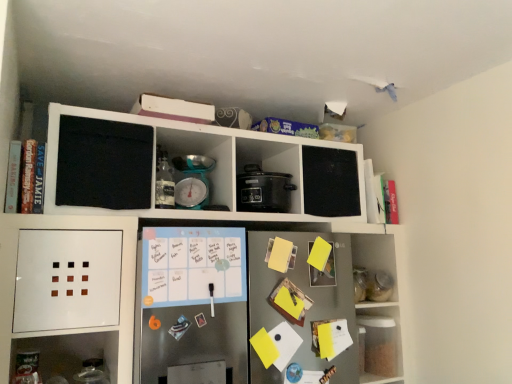
Locate an element on the screen. This screenshot has height=384, width=512. teal plastic scale at center, which is counted as the 1th appliance, starting from the left is located at coordinates (193, 181).

Measure the distance between point (280,285) and camera.

They are 5.53 feet apart.

Identify the location of hardcover book at left, the third book positioned from the right. (25, 176).

Considering the relative sizes of clear plastic container at lower right, the second shelf positioned from the left, and hardcover book at upper right, which ranks as the first book in back-to-front order, in the image provided, is clear plastic container at lower right, the second shelf positioned from the left, thinner than hardcover book at upper right, which ranks as the first book in back-to-front order,?

Incorrect, the width of clear plastic container at lower right, the second shelf positioned from the left, is not less than that of hardcover book at upper right, which ranks as the first book in back-to-front order.

From the image's perspective, is clear plastic container at lower right, the second shelf positioned from the left, located above or below hardcover book at upper right, which is the third book from front to back?

Based on their image positions, clear plastic container at lower right, the second shelf positioned from the left, is located beneath hardcover book at upper right, which is the third book from front to back.

From a real-world perspective, relative to hardcover book at upper right, which ranks as the third book in left-to-right order, is clear plastic container at lower right, the second shelf positioned from the left, vertically above or below?

clear plastic container at lower right, the second shelf positioned from the left, is situated lower than hardcover book at upper right, which ranks as the third book in left-to-right order, in the real world.

How many degrees apart are the facing directions of clear plastic container at lower right, the second shelf positioned from the left, and hardcover book at upper right, the first book when ordered from right to left?

0.0544 degrees.

Which of these two, hardcover book at upper right, the first book when ordered from right to left, or white matte refrigerator at center, the 1th shelf in the left-to-right sequence, is smaller?

With smaller size is hardcover book at upper right, the first book when ordered from right to left.

Considering the sizes of objects hardcover book at upper right, the first book when ordered from right to left, and white matte refrigerator at center, which is counted as the second shelf, starting from the right, in the image provided, who is shorter, hardcover book at upper right, the first book when ordered from right to left, or white matte refrigerator at center, which is counted as the second shelf, starting from the right,?

With less height is hardcover book at upper right, the first book when ordered from right to left.

Is hardcover book at upper right, the first book when ordered from right to left, not within white matte refrigerator at center, the 1th shelf in the left-to-right sequence?

Yes, hardcover book at upper right, the first book when ordered from right to left, is located beyond the bounds of white matte refrigerator at center, the 1th shelf in the left-to-right sequence.

From the image's perspective, is hardcover book at upper right, the first book when ordered from right to left, below white matte refrigerator at center, the 1th shelf in the left-to-right sequence?

No, from the image's perspective, hardcover book at upper right, the first book when ordered from right to left, is not below white matte refrigerator at center, the 1th shelf in the left-to-right sequence.

Which is in front, yellow paper at center, which appears as the second book when viewed from the back, or black matte slow cooker at center, acting as the 2th appliance starting from the left?

yellow paper at center, which appears as the second book when viewed from the back, is in front.

In terms of height, does yellow paper at center, which is the 2th book in left-to-right order, look taller or shorter compared to black matte slow cooker at center, the first appliance viewed from the right?

In the image, yellow paper at center, which is the 2th book in left-to-right order, appears to be taller than black matte slow cooker at center, the first appliance viewed from the right.

At what (x,y) coordinates should I click in order to perform the action: click on book that is the 2nd object directly below the black matte slow cooker at center, the first appliance viewed from the right (from a real-world perspective). Please return your answer as a coordinate pair (x, y). This screenshot has width=512, height=384. Looking at the image, I should click on (290, 302).

Which point is more distant from viewer, (278, 194) or (195, 168)?

The point (278, 194) is farther from the camera.

Which object is positioned more to the right, black matte slow cooker at center, the first appliance viewed from the right, or teal plastic scale at center, the 2th appliance when ordered from right to left?

black matte slow cooker at center, the first appliance viewed from the right, is more to the right.

Are black matte slow cooker at center, acting as the 2th appliance starting from the left, and teal plastic scale at center, the 2th appliance when ordered from right to left, beside each other?

There is a gap between black matte slow cooker at center, acting as the 2th appliance starting from the left, and teal plastic scale at center, the 2th appliance when ordered from right to left.

Considering the relative positions of black matte slow cooker at center, acting as the 2th appliance starting from the left, and teal plastic scale at center, which is counted as the 1th appliance, starting from the left, in the image provided, is black matte slow cooker at center, acting as the 2th appliance starting from the left, behind teal plastic scale at center, which is counted as the 1th appliance, starting from the left,?

Yes, it is behind teal plastic scale at center, which is counted as the 1th appliance, starting from the left.

Can you confirm if hardcover book at left, positioned as the 3th book in back-to-front order, is wider than hardcover book at upper right, which ranks as the third book in left-to-right order?

Correct, the width of hardcover book at left, positioned as the 3th book in back-to-front order, exceeds that of hardcover book at upper right, which ranks as the third book in left-to-right order.

Which object is positioned more to the right, hardcover book at left, the third book positioned from the right, or hardcover book at upper right, the first book when ordered from right to left?

Positioned to the right is hardcover book at upper right, the first book when ordered from right to left.

From the image's perspective, which is above, hardcover book at left, the 1th book viewed from the front, or hardcover book at upper right, which is the third book from front to back?

hardcover book at left, the 1th book viewed from the front, is shown above in the image.

Is hardcover book at left, arranged as the 1th book when viewed from the left, looking in the opposite direction of hardcover book at upper right, which ranks as the first book in back-to-front order?

That's not correct — hardcover book at left, arranged as the 1th book when viewed from the left, is not looking away from hardcover book at upper right, which ranks as the first book in back-to-front order.

Would you say yellow paper at center, the second book from the right, is to the left or to the right of clear plastic container at lower right, the second shelf positioned from the left, in the picture?

From the image, it's evident that yellow paper at center, the second book from the right, is to the left of clear plastic container at lower right, the second shelf positioned from the left.

Is yellow paper at center, placed as the 2th book when sorted from front to back, turned away from clear plastic container at lower right, marked as the 1th shelf in a right-to-left arrangement?

That's not correct — yellow paper at center, placed as the 2th book when sorted from front to back, is not looking away from clear plastic container at lower right, marked as the 1th shelf in a right-to-left arrangement.

Considering the sizes of objects yellow paper at center, placed as the 2th book when sorted from front to back, and clear plastic container at lower right, the second shelf positioned from the left, in the image provided, who is taller, yellow paper at center, placed as the 2th book when sorted from front to back, or clear plastic container at lower right, the second shelf positioned from the left,?

clear plastic container at lower right, the second shelf positioned from the left.

From the image's perspective, is yellow paper at center, which appears as the second book when viewed from the back, positioned above or below clear plastic container at lower right, the second shelf positioned from the left?

yellow paper at center, which appears as the second book when viewed from the back, is above clear plastic container at lower right, the second shelf positioned from the left.

Are white matte refrigerator at center, which is counted as the second shelf, starting from the right, and teal plastic scale at center, the 2th appliance when ordered from right to left, far apart?

No, there isn't a large distance between white matte refrigerator at center, which is counted as the second shelf, starting from the right, and teal plastic scale at center, the 2th appliance when ordered from right to left.

Can you confirm if white matte refrigerator at center, which is counted as the second shelf, starting from the right, is thinner than teal plastic scale at center, which is counted as the 1th appliance, starting from the left?

In fact, white matte refrigerator at center, which is counted as the second shelf, starting from the right, might be wider than teal plastic scale at center, which is counted as the 1th appliance, starting from the left.

Which book is the 1st one when counting from the left side of the clear plastic container at lower right, the second shelf positioned from the left? Please provide its 2D coordinates.

[(379, 197)]

From a real-world perspective, which book is the 3rd one above the white matte refrigerator at center, the 1th shelf in the left-to-right sequence? Please provide its 2D coordinates.

[(379, 197)]

Estimate the real-world distances between objects in this image. Which object is further from clear plastic container at lower right, marked as the 1th shelf in a right-to-left arrangement, white matte refrigerator at center, which is counted as the second shelf, starting from the right, or teal plastic scale at center, the 2th appliance when ordered from right to left?

Based on the image, teal plastic scale at center, the 2th appliance when ordered from right to left, appears to be further to clear plastic container at lower right, marked as the 1th shelf in a right-to-left arrangement.

Looking at the image, which one is located further to yellow paper at center, which is the 2th book in left-to-right order, hardcover book at left, positioned as the 3th book in back-to-front order, or clear plastic container at lower right, marked as the 1th shelf in a right-to-left arrangement?

The object further to yellow paper at center, which is the 2th book in left-to-right order, is hardcover book at left, positioned as the 3th book in back-to-front order.

Considering their positions, is clear plastic container at lower right, marked as the 1th shelf in a right-to-left arrangement, positioned closer to yellow paper at center, which appears as the second book when viewed from the back, than white matte refrigerator at center, which is counted as the second shelf, starting from the right?

white matte refrigerator at center, which is counted as the second shelf, starting from the right, is positioned closer to the anchor yellow paper at center, which appears as the second book when viewed from the back.

Considering their positions, is yellow paper at center, the second book from the right, positioned further to white matte refrigerator at center, the 1th shelf in the left-to-right sequence, than hardcover book at left, the third book positioned from the right?

hardcover book at left, the third book positioned from the right.

From the image, which object appears to be farther from hardcover book at upper right, the first book when ordered from right to left, yellow paper at center, the second book from the right, or hardcover book at left, the third book positioned from the right?

hardcover book at left, the third book positioned from the right, is positioned further to the anchor hardcover book at upper right, the first book when ordered from right to left.

Considering their positions, is hardcover book at upper right, the first book when ordered from right to left, positioned closer to teal plastic scale at center, the 2th appliance when ordered from right to left, than white matte refrigerator at center, the 1th shelf in the left-to-right sequence?

Based on the image, white matte refrigerator at center, the 1th shelf in the left-to-right sequence, appears to be nearer to teal plastic scale at center, the 2th appliance when ordered from right to left.

Which object lies further to the anchor point yellow paper at center, which is the 2th book in left-to-right order, black matte slow cooker at center, acting as the 2th appliance starting from the left, or clear plastic container at lower right, marked as the 1th shelf in a right-to-left arrangement?

The object further to yellow paper at center, which is the 2th book in left-to-right order, is clear plastic container at lower right, marked as the 1th shelf in a right-to-left arrangement.

Looking at the image, which one is located closer to black matte slow cooker at center, the first appliance viewed from the right, yellow paper at center, which appears as the second book when viewed from the back, or clear plastic container at lower right, marked as the 1th shelf in a right-to-left arrangement?

yellow paper at center, which appears as the second book when viewed from the back, is closer to black matte slow cooker at center, the first appliance viewed from the right.

Where is `appliance between teal plastic scale at center, which is counted as the 1th appliance, starting from the left, and hardcover book at upper right, which ranks as the third book in left-to-right order, from left to right`? The height and width of the screenshot is (384, 512). appliance between teal plastic scale at center, which is counted as the 1th appliance, starting from the left, and hardcover book at upper right, which ranks as the third book in left-to-right order, from left to right is located at coordinates (263, 190).

Where is `appliance between white matte refrigerator at center, which is counted as the second shelf, starting from the right, and clear plastic container at lower right, the second shelf positioned from the left`? The width and height of the screenshot is (512, 384). appliance between white matte refrigerator at center, which is counted as the second shelf, starting from the right, and clear plastic container at lower right, the second shelf positioned from the left is located at coordinates (263, 190).

The width and height of the screenshot is (512, 384). I want to click on shelf between hardcover book at left, positioned as the 3th book in back-to-front order, and hardcover book at upper right, the first book when ordered from right to left, in the horizontal direction, so pyautogui.click(x=179, y=300).

You are a GUI agent. You are given a task and a screenshot of the screen. Output one action in this format:
    pyautogui.click(x=<x>, y=<y>)
    Task: Click on the shelf situated between hardcover book at left, the third book positioned from the right, and clear plastic container at lower right, the second shelf positioned from the left, from left to right
    
    Given the screenshot: What is the action you would take?
    pyautogui.click(x=179, y=300)